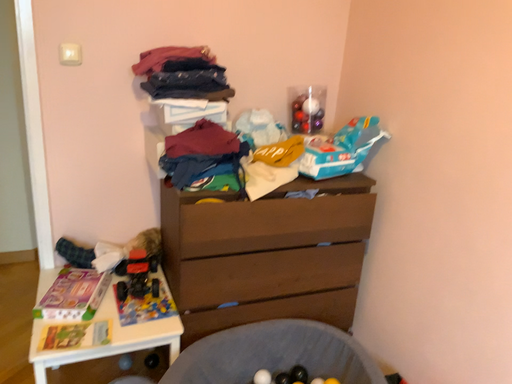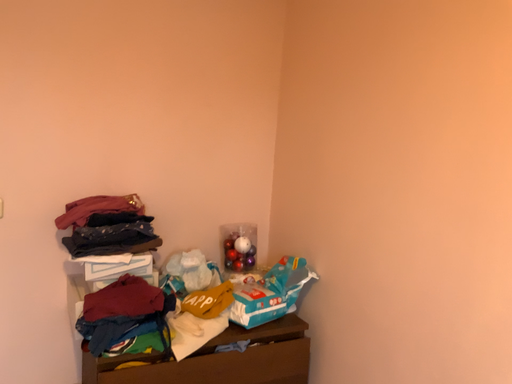
Question: Which way did the camera rotate in the video?

Choices:
 (A) rotated downward
 (B) rotated upward

Answer: (B)